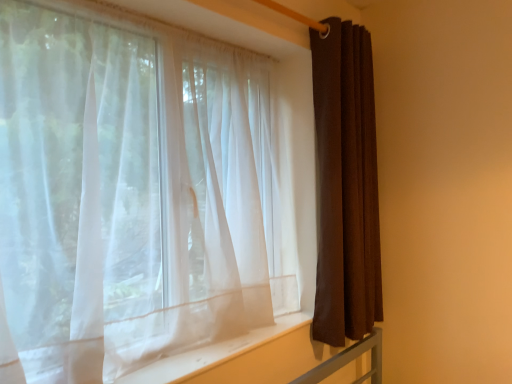
Question: Is sheer white curtain at left, which ranks as the second curtain in right-to-left order, behind brown fabric curtain at right, marked as the 1th curtain in a right-to-left arrangement?

Choices:
 (A) no
 (B) yes

Answer: (A)

Question: Does sheer white curtain at left, which is counted as the 1th curtain, starting from the left, have a larger size compared to brown fabric curtain at right, marked as the 1th curtain in a right-to-left arrangement?

Choices:
 (A) yes
 (B) no

Answer: (A)

Question: Can you confirm if sheer white curtain at left, which ranks as the second curtain in right-to-left order, is taller than brown fabric curtain at right, marked as the 1th curtain in a right-to-left arrangement?

Choices:
 (A) yes
 (B) no

Answer: (B)

Question: Can you confirm if sheer white curtain at left, which is counted as the 1th curtain, starting from the left, is smaller than brown fabric curtain at right, marked as the 1th curtain in a right-to-left arrangement?

Choices:
 (A) no
 (B) yes

Answer: (A)

Question: Could you tell me if sheer white curtain at left, which ranks as the second curtain in right-to-left order, is facing brown fabric curtain at right, which is the 2th curtain from left to right?

Choices:
 (A) no
 (B) yes

Answer: (A)

Question: Considering the relative sizes of sheer white curtain at left, which ranks as the second curtain in right-to-left order, and brown fabric curtain at right, marked as the 1th curtain in a right-to-left arrangement, in the image provided, is sheer white curtain at left, which ranks as the second curtain in right-to-left order, thinner than brown fabric curtain at right, marked as the 1th curtain in a right-to-left arrangement,?

Choices:
 (A) yes
 (B) no

Answer: (B)

Question: Is the position of white sheer fabric at lower center more distant than that of brown fabric curtain at right, which is the 2th curtain from left to right?

Choices:
 (A) no
 (B) yes

Answer: (A)

Question: Does white sheer fabric at lower center have a greater height compared to brown fabric curtain at right, which is the 2th curtain from left to right?

Choices:
 (A) no
 (B) yes

Answer: (A)

Question: Considering the relative positions of white sheer fabric at lower center and brown fabric curtain at right, which is the 2th curtain from left to right, in the image provided, is white sheer fabric at lower center to the right of brown fabric curtain at right, which is the 2th curtain from left to right, from the viewer's perspective?

Choices:
 (A) no
 (B) yes

Answer: (A)

Question: Does white sheer fabric at lower center appear on the left side of brown fabric curtain at right, marked as the 1th curtain in a right-to-left arrangement?

Choices:
 (A) yes
 (B) no

Answer: (A)

Question: Can you confirm if white sheer fabric at lower center is shorter than brown fabric curtain at right, marked as the 1th curtain in a right-to-left arrangement?

Choices:
 (A) no
 (B) yes

Answer: (B)

Question: Does white sheer fabric at lower center turn towards brown fabric curtain at right, which is the 2th curtain from left to right?

Choices:
 (A) yes
 (B) no

Answer: (B)

Question: Is there a large distance between brown fabric curtain at right, which is the 2th curtain from left to right, and white sheer fabric at lower center?

Choices:
 (A) yes
 (B) no

Answer: (B)